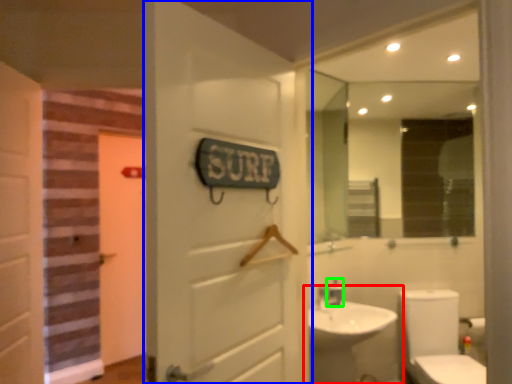
Question: Based on their relative distances, which object is farther from sink (highlighted by a red box)? Choose from door (highlighted by a blue box) and faucet (highlighted by a green box).

Choices:
 (A) door
 (B) faucet

Answer: (A)